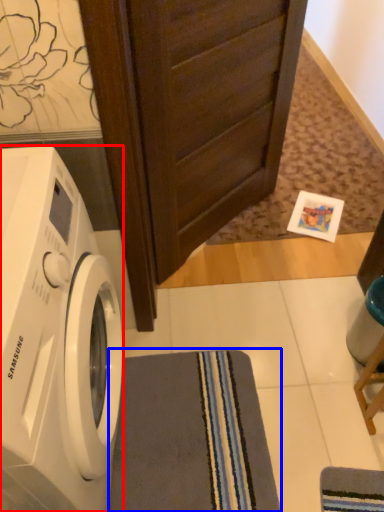
Question: Among these objects, which one is farthest to the camera, washing machine (highlighted by a red box) or bath towel (highlighted by a blue box)?

Choices:
 (A) washing machine
 (B) bath towel

Answer: (B)